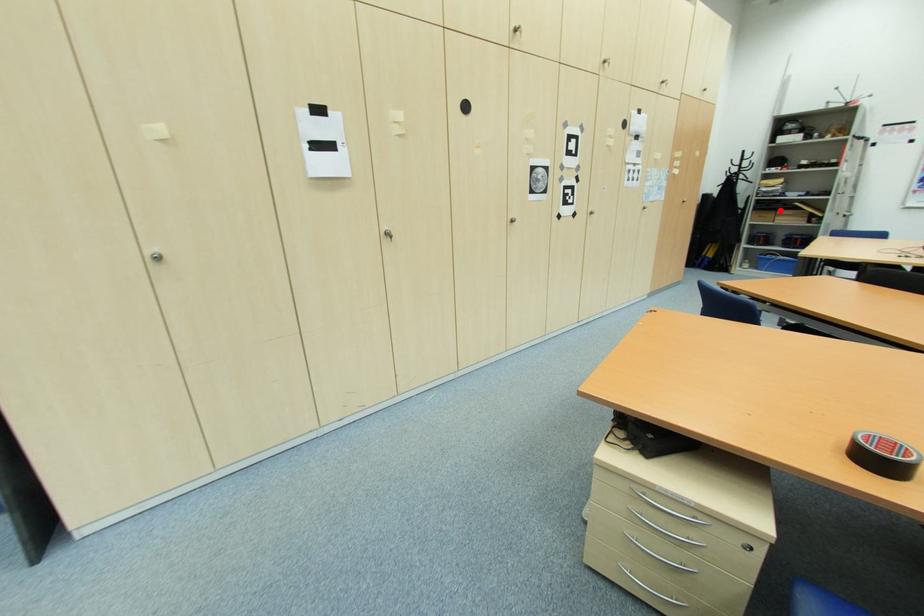
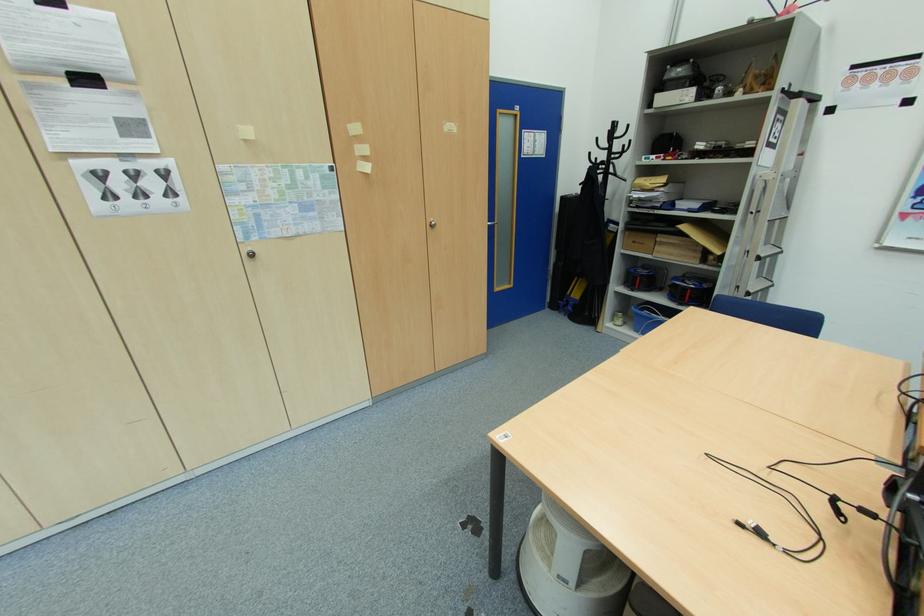
Where in the second image is the point corresponding to the highlighted location from the first image?

(660, 233)